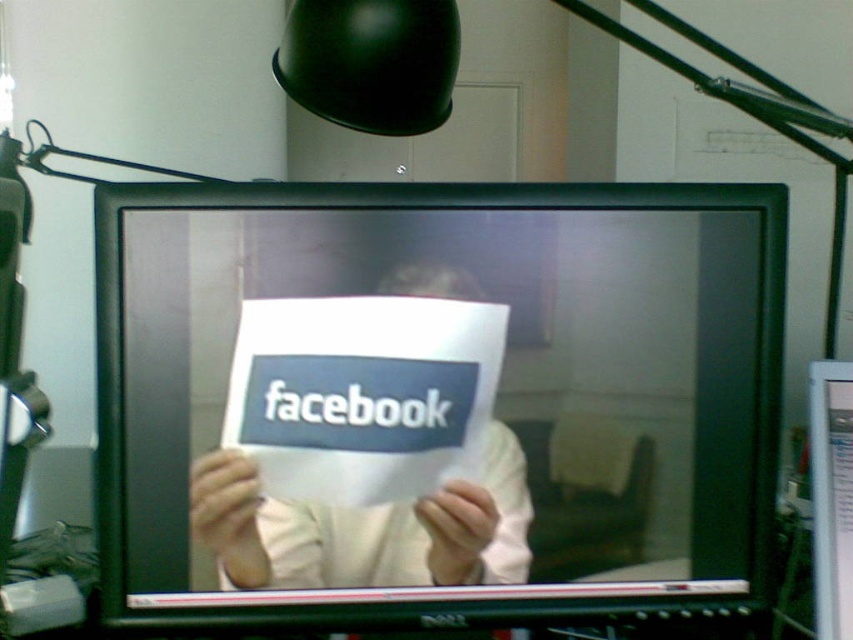
Question: Is black glossy monitor at center to the left of white paper at center from the viewer's perspective?

Choices:
 (A) yes
 (B) no

Answer: (B)

Question: Does black glossy monitor at center appear on the right side of white paper at center?

Choices:
 (A) yes
 (B) no

Answer: (A)

Question: Does black glossy monitor at center lie in front of white paper at center?

Choices:
 (A) yes
 (B) no

Answer: (A)

Question: Which point is farther to the camera?

Choices:
 (A) pos(613,444)
 (B) pos(469,524)

Answer: (A)